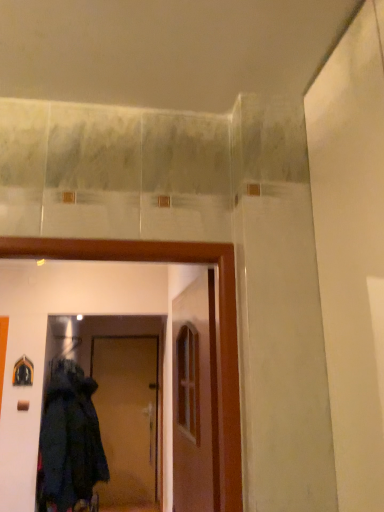
Question: Considering the relative sizes of wooden door at center, the second door in the left-to-right sequence, and brown matte door at center, which ranks as the second door in top-to-bottom order, in the image provided, is wooden door at center, the second door in the left-to-right sequence, smaller than brown matte door at center, which ranks as the second door in top-to-bottom order,?

Choices:
 (A) no
 (B) yes

Answer: (B)

Question: From a real-world perspective, is wooden door at center, the second door in the left-to-right sequence, physically below brown matte door at center, which appears as the 1th door when viewed from the left?

Choices:
 (A) yes
 (B) no

Answer: (B)

Question: Is brown matte door at center, arranged as the first door when ordered from the bottom, surrounded by wooden door at center, which is the first door in right-to-left order?

Choices:
 (A) yes
 (B) no

Answer: (B)

Question: Would you consider wooden door at center, arranged as the first door when viewed from the front, to be distant from brown matte door at center, the first door from the back?

Choices:
 (A) no
 (B) yes

Answer: (B)

Question: From the image's perspective, would you say wooden door at center, the second door in the left-to-right sequence, is shown under brown matte door at center, which is the second door in right-to-left order?

Choices:
 (A) no
 (B) yes

Answer: (A)

Question: Choose the correct answer: Is brown matte door at center, arranged as the first door when ordered from the bottom, inside wooden door at center, marked as the second door in a bottom-to-top arrangement, or outside it?

Choices:
 (A) inside
 (B) outside

Answer: (B)

Question: Considering the positions of brown matte door at center, which appears as the 1th door when viewed from the left, and wooden door at center, the second door in the left-to-right sequence, in the image, is brown matte door at center, which appears as the 1th door when viewed from the left, wider or thinner than wooden door at center, the second door in the left-to-right sequence,?

Choices:
 (A) wide
 (B) thin

Answer: (A)

Question: Considering their positions, is brown matte door at center, which is the second door in right-to-left order, located in front of or behind wooden door at center, which is the 2th door from back to front?

Choices:
 (A) behind
 (B) front

Answer: (A)

Question: Does point (155, 455) appear closer or farther from the camera than point (196, 445)?

Choices:
 (A) closer
 (B) farther

Answer: (B)

Question: Relative to dark woolen coat at lower left, is wooden door at center, which is the 2th door from back to front, in front or behind?

Choices:
 (A) front
 (B) behind

Answer: (A)

Question: Is wooden door at center, marked as the second door in a bottom-to-top arrangement, to the left or to the right of dark woolen coat at lower left in the image?

Choices:
 (A) right
 (B) left

Answer: (A)

Question: From a real-world perspective, is wooden door at center, marked as the second door in a bottom-to-top arrangement, above or below dark woolen coat at lower left?

Choices:
 (A) above
 (B) below

Answer: (A)

Question: Is wooden door at center, the second door in the left-to-right sequence, inside the boundaries of dark woolen coat at lower left, or outside?

Choices:
 (A) outside
 (B) inside

Answer: (A)

Question: Choose the correct answer: Is dark woolen coat at lower left inside wooden door at center, the first door in the top-to-bottom sequence, or outside it?

Choices:
 (A) inside
 (B) outside

Answer: (B)

Question: Considering the positions of point (41, 414) and point (183, 347), is point (41, 414) closer or farther from the camera than point (183, 347)?

Choices:
 (A) closer
 (B) farther

Answer: (A)